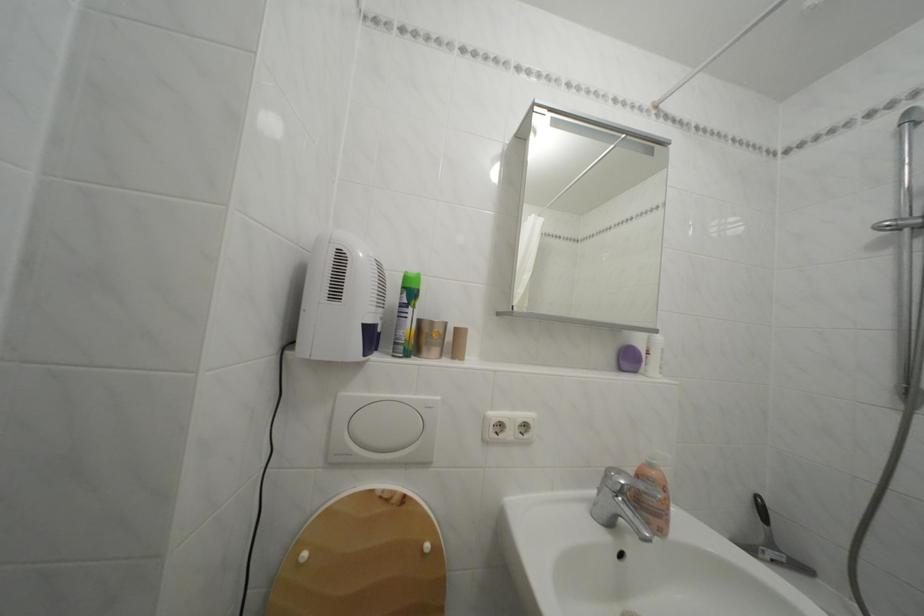
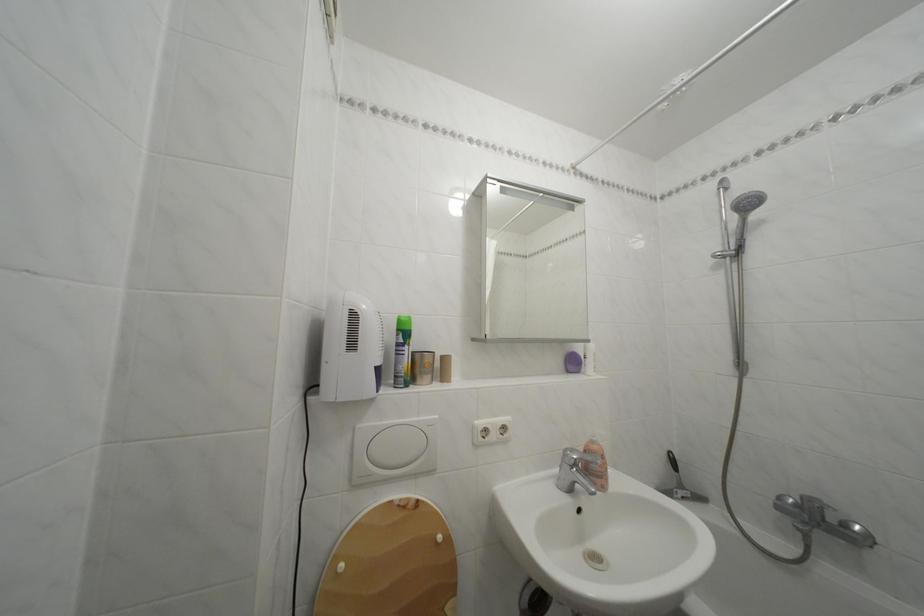
Find the pixel in the second image that matches point 660,472 in the first image.

(602, 448)